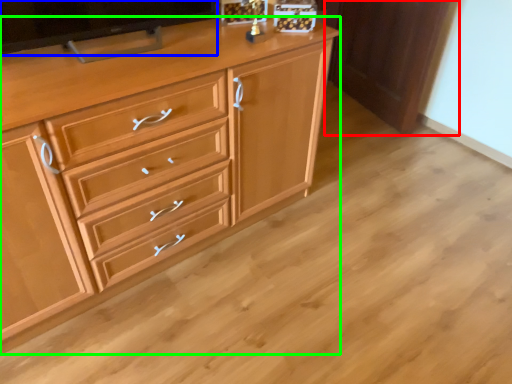
Question: Estimate the real-world distances between objects in this image. Which object is farther from cabinetry (highlighted by a red box), television (highlighted by a blue box) or chest of drawers (highlighted by a green box)?

Choices:
 (A) television
 (B) chest of drawers

Answer: (A)